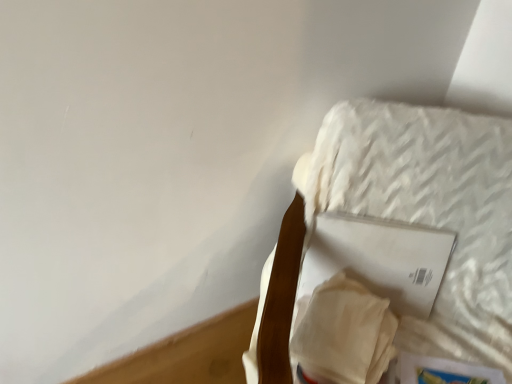
Question: Does white textured mattress at upper right have a larger size compared to hardcover book at lower right, which is counted as the second paperback book, starting from the top?

Choices:
 (A) yes
 (B) no

Answer: (A)

Question: Is white textured mattress at upper right to the left of hardcover book at lower right, which is counted as the second paperback book, starting from the top, from the viewer's perspective?

Choices:
 (A) yes
 (B) no

Answer: (A)

Question: From a real-world perspective, is white textured mattress at upper right on top of hardcover book at lower right, positioned as the first paperback book in bottom-to-top order?

Choices:
 (A) no
 (B) yes

Answer: (B)

Question: Considering the relative positions of white textured mattress at upper right and hardcover book at lower right, positioned as the first paperback book in bottom-to-top order, in the image provided, is white textured mattress at upper right in front of hardcover book at lower right, positioned as the first paperback book in bottom-to-top order,?

Choices:
 (A) no
 (B) yes

Answer: (B)

Question: Is white textured mattress at upper right completely or partially outside of hardcover book at lower right, positioned as the first paperback book in bottom-to-top order?

Choices:
 (A) no
 (B) yes

Answer: (B)

Question: From the image's perspective, is white textured mattress at upper right on hardcover book at lower right, which is counted as the second paperback book, starting from the top?

Choices:
 (A) yes
 (B) no

Answer: (A)

Question: Is hardcover book at lower right, which is counted as the second paperback book, starting from the top, looking in the opposite direction of white textured mattress at upper right?

Choices:
 (A) no
 (B) yes

Answer: (B)

Question: Can you confirm if hardcover book at lower right, positioned as the first paperback book in bottom-to-top order, is taller than white textured mattress at upper right?

Choices:
 (A) yes
 (B) no

Answer: (B)

Question: From a real-world perspective, is hardcover book at lower right, positioned as the first paperback book in bottom-to-top order, positioned under white textured mattress at upper right based on gravity?

Choices:
 (A) yes
 (B) no

Answer: (A)

Question: Considering the relative sizes of hardcover book at lower right, positioned as the first paperback book in bottom-to-top order, and white textured mattress at upper right in the image provided, is hardcover book at lower right, positioned as the first paperback book in bottom-to-top order, thinner than white textured mattress at upper right?

Choices:
 (A) no
 (B) yes

Answer: (B)

Question: From the image's perspective, is hardcover book at lower right, positioned as the first paperback book in bottom-to-top order, on top of white textured mattress at upper right?

Choices:
 (A) yes
 (B) no

Answer: (B)

Question: Considering the relative sizes of hardcover book at lower right, positioned as the first paperback book in bottom-to-top order, and white textured mattress at upper right in the image provided, is hardcover book at lower right, positioned as the first paperback book in bottom-to-top order, smaller than white textured mattress at upper right?

Choices:
 (A) no
 (B) yes

Answer: (B)

Question: From the image's perspective, is hardcover book at lower right, which is counted as the second paperback book, starting from the top, located beneath white matte paper at upper right, the 2th paperback book when ordered from bottom to top?

Choices:
 (A) no
 (B) yes

Answer: (B)